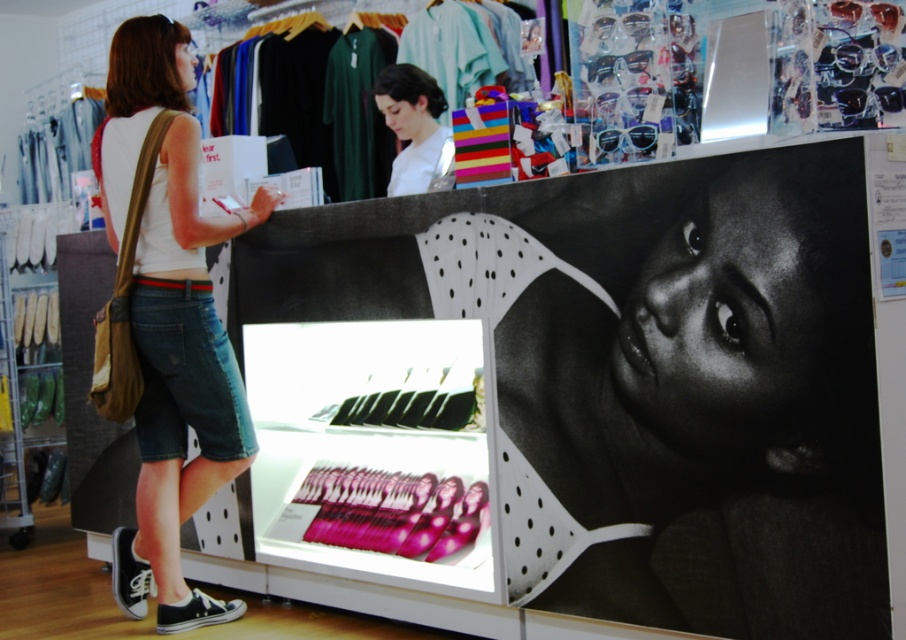
Who is positioned more to the left, metallic silver poster at center or denim shorts at left?

From the viewer's perspective, denim shorts at left appears more on the left side.

Who is positioned more to the right, metallic silver poster at center or denim shorts at left?

Positioned to the right is metallic silver poster at center.

Which is behind, point (320, 547) or point (167, 220)?

Positioned behind is point (320, 547).

Locate an element on the screen. Image resolution: width=906 pixels, height=640 pixels. metallic silver poster at center is located at coordinates (372, 451).

Describe the element at coordinates (372, 451) in the screenshot. I see `metallic silver poster at center` at that location.

Can you confirm if metallic silver poster at center is positioned above white matte shirt at upper center?

No, metallic silver poster at center is not above white matte shirt at upper center.

Which is in front, point (374, 403) or point (426, 86)?

Positioned in front is point (374, 403).

I want to click on metallic silver poster at center, so [372, 451].

Is denim shorts at left further to the viewer compared to white matte shirt at upper center?

No.

Who is higher up, denim shorts at left or white matte shirt at upper center?

white matte shirt at upper center is higher up.

The image size is (906, 640). In order to click on denim shorts at left in this screenshot , I will do `click(171, 321)`.